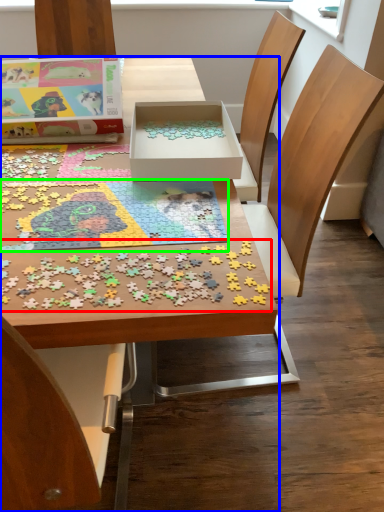
Question: Which object is the closest to the jigsaw puzzle (highlighted by a red box)? Choose among these: table (highlighted by a blue box) or jigsaw puzzle (highlighted by a green box).

Choices:
 (A) table
 (B) jigsaw puzzle

Answer: (B)